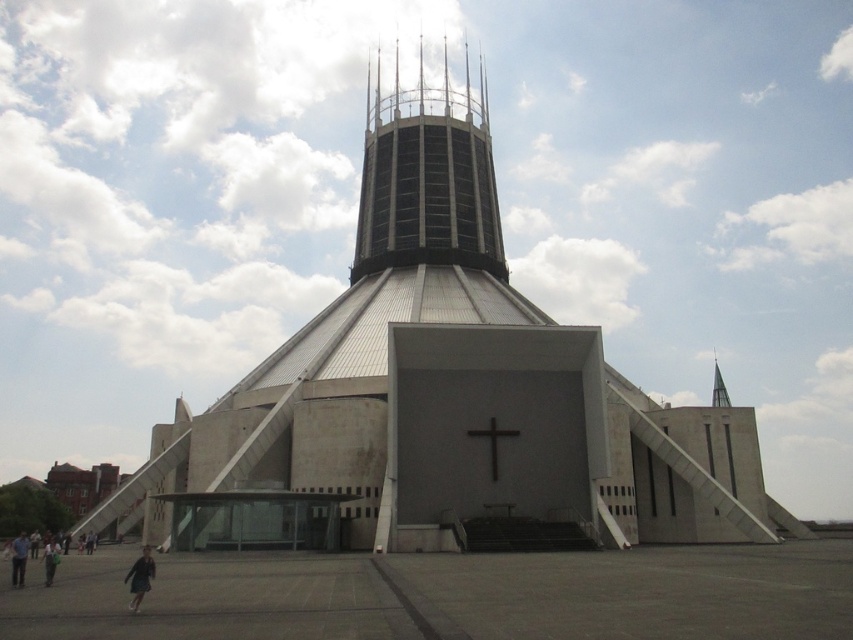
Consider the image. You are standing at the entrance of the cathedral and see two points marked on the building. The first point is located at coordinates point (488, 433) and the second at point (712, 356). Which point is closer to you?

Point (488, 433) is in front of point (712, 356), so it is closer to you.

You are standing in front of a modern architectural structure. You want to take a photo of the white concrete church at center. If your camera can focus on objects up to 50 meters away, will it be able to capture the church clearly?

The white concrete church at center is 50.02 meters away from camera, which is slightly beyond the camera maximum focus range of 50 meters. The camera may not be able to capture the church clearly.

You are planning to install a new lighting system between the white concrete church at center and the shiny silver spire at upper right. The system requires a cable that can span the distance between them. If the cable you have is 50 meters long, will it be sufficient to connect them?

The distance between the white concrete church at center and the shiny silver spire at upper right is 48.91 meters. Since the cable is 50 meters long, it will be sufficient to connect them as it is longer than the required distance.